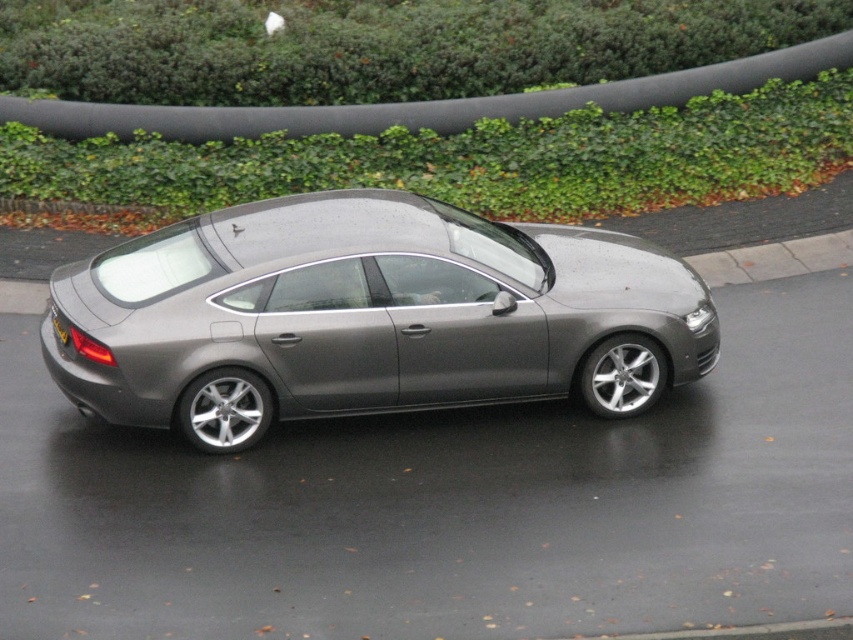
You are standing in front of the Audi A7 sedan and want to determine the position of two points marked on the car. The points are labeled as point 1 at coordinates (416, 388) and point 2 at (64, 344). Which point is closer to you?

Point 2 at (64, 344) is closer to you because it is nearer to the camera compared to point 1 at (416, 388).

You are a parking attendant who needs to guide a driver to park their car. The driver wants to park their car so that the yellow plastic license plate at rear is positioned to the left of the car. Is the current position of the satin metallic car at center aligned with this requirement?

The satin metallic car at center is currently positioned to the right of the yellow plastic license plate at rear, which means the license plate is already to the left of the car. Therefore, the current position meets the driver requirement.

You are a delivery person trying to load a package onto the roof of the satin metallic car at center. The package is 1.2 meters tall. Considering the yellow plastic license plate at rear is already mounted, will the package fit without touching the black pipe above the hedge?

The satin metallic car at center has a greater height compared to the yellow plastic license plate at rear. Since the license plate is already mounted on the car, the package height of 1.2 meters must be compared to the car roof height. However, the description only states the car is taller than the license plate, not providing exact measurements. Without knowing the exact height difference, it is uncertain if the package will fit under the black pipe.